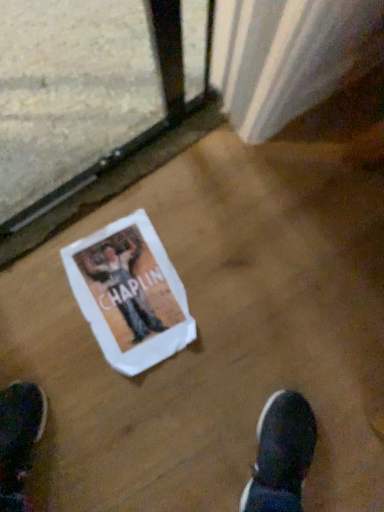
Question: Is clear glass train window at lower left surrounded by white paper flyer at center?

Choices:
 (A) yes
 (B) no

Answer: (B)

Question: Is white paper flyer at center next to clear glass train window at lower left?

Choices:
 (A) yes
 (B) no

Answer: (B)

Question: Is white paper flyer at center smaller than clear glass train window at lower left?

Choices:
 (A) yes
 (B) no

Answer: (A)

Question: Can you confirm if white paper flyer at center is bigger than clear glass train window at lower left?

Choices:
 (A) no
 (B) yes

Answer: (A)

Question: Can you confirm if white paper flyer at center is shorter than clear glass train window at lower left?

Choices:
 (A) yes
 (B) no

Answer: (A)

Question: Is white paper flyer at center closer to camera compared to clear glass train window at lower left?

Choices:
 (A) no
 (B) yes

Answer: (A)

Question: Is clear glass train window at lower left at the left side of white paper flyer at center?

Choices:
 (A) no
 (B) yes

Answer: (B)

Question: Is there a large distance between clear glass train window at lower left and white paper flyer at center?

Choices:
 (A) yes
 (B) no

Answer: (B)

Question: Is the surface of clear glass train window at lower left in direct contact with white paper flyer at center?

Choices:
 (A) no
 (B) yes

Answer: (A)

Question: Could you tell me if clear glass train window at lower left is facing white paper flyer at center?

Choices:
 (A) no
 (B) yes

Answer: (A)

Question: Is the position of clear glass train window at lower left less distant than that of white paper flyer at center?

Choices:
 (A) no
 (B) yes

Answer: (B)

Question: Would you say white paper flyer at center is part of clear glass train window at lower left's contents?

Choices:
 (A) yes
 (B) no

Answer: (B)

Question: In the image, is clear glass train window at lower left positioned in front of or behind white paper flyer at center?

Choices:
 (A) front
 (B) behind

Answer: (A)